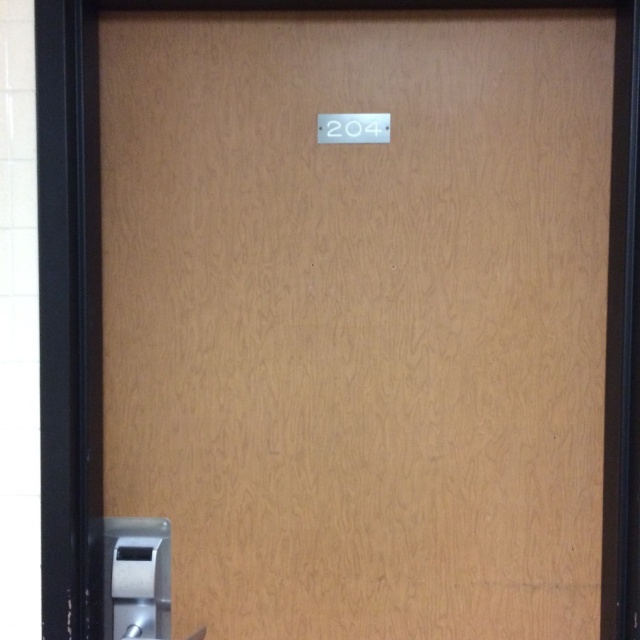
You are a delivery person trying to deliver a package to room 204. You see a wooden door with a light brown finish. There is a satin nickel door handle at bottom left and a white glossy door lock at upper center. Which object should you interact with first to open the door?

You should interact with the satin nickel door handle at bottom left first because door handles are typically used to open doors, while door locks are for securing the door. Even though the white glossy door lock at upper center might be part of the locking mechanism, the handle is the primary tool for opening the door.

You are a maintenance worker who needs to replace the satin nickel door handle at bottom left and the white glossy door lock at upper center. Which object should you adjust first if you want to start from the lower part of the door?

The satin nickel door handle at bottom left should be adjusted first since it is located below the white glossy door lock at upper center, making it the lower component.

In the scene shown: You are standing in front of the wooden door with a light brown finish. You need to locate the satin nickel door handle at bottom left. Where exactly is it positioned on the door?

The satin nickel door handle at bottom left is positioned at the coordinates point (136, 579) on the door.